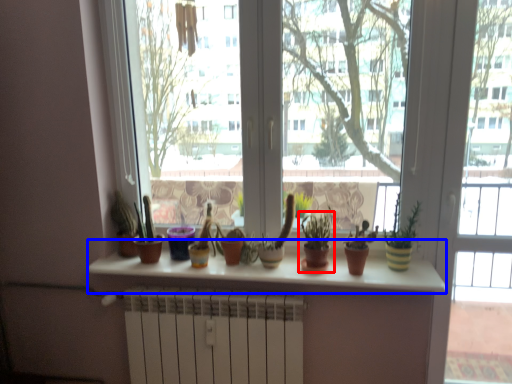
Question: Which point is further to the camera, houseplant (highlighted by a red box) or counter top (highlighted by a blue box)?

Choices:
 (A) houseplant
 (B) counter top

Answer: (A)